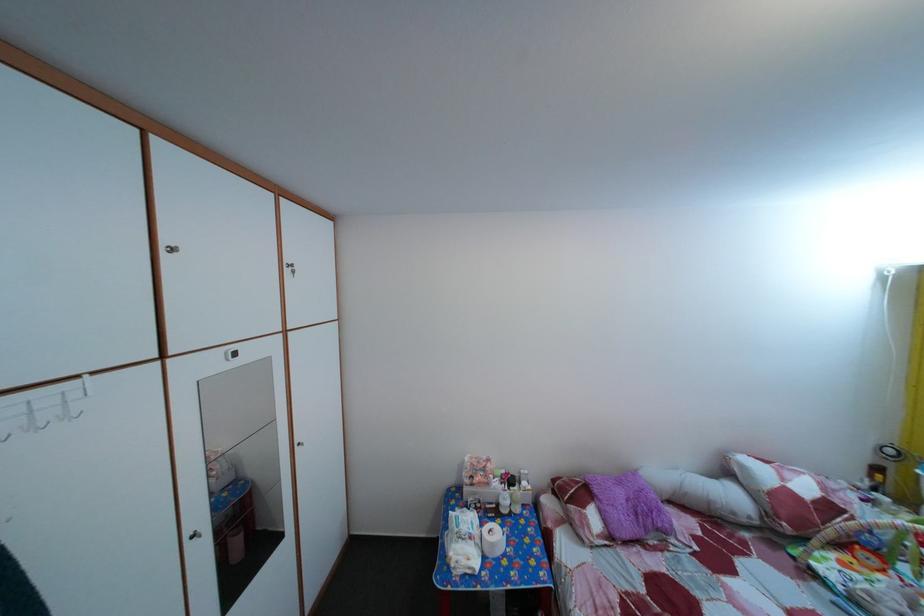
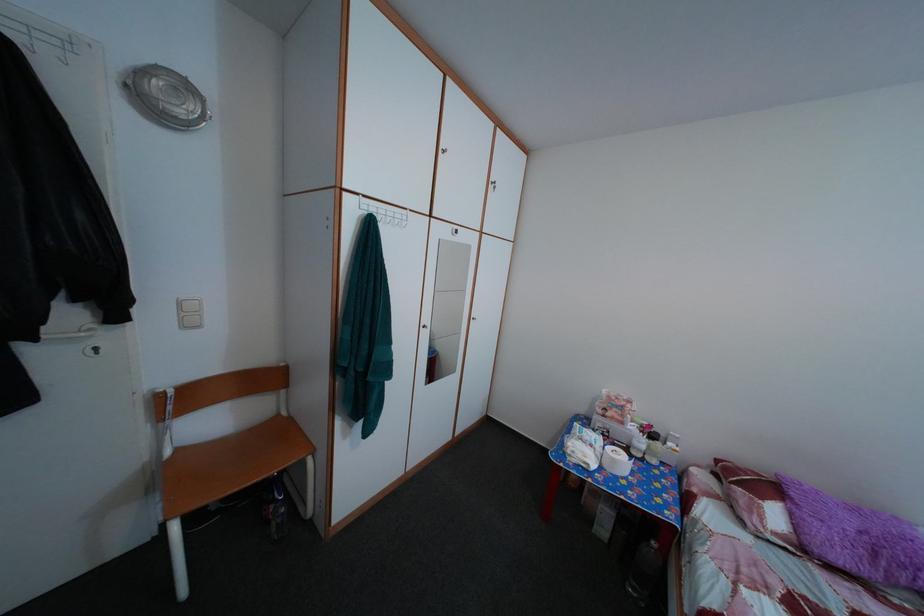
Question: The camera is either moving clockwise (left) or counter-clockwise (right) around the object. The first image is from the beginning of the video and the second image is from the end. Is the camera moving left or right when shooting the video?

Choices:
 (A) Left
 (B) Right

Answer: (B)